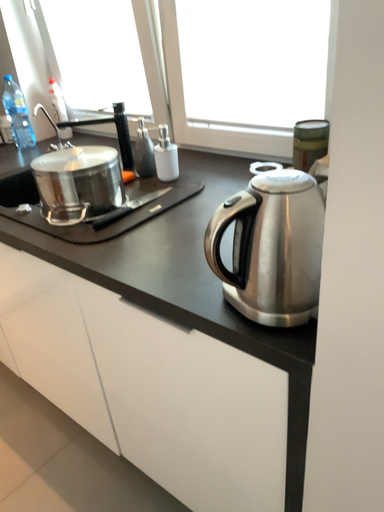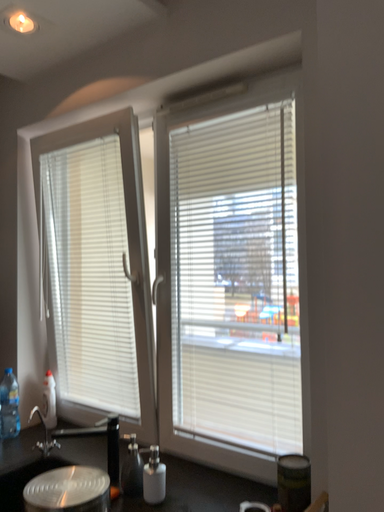
Question: How did the camera likely rotate when shooting the video?

Choices:
 (A) rotated upward
 (B) rotated downward

Answer: (A)